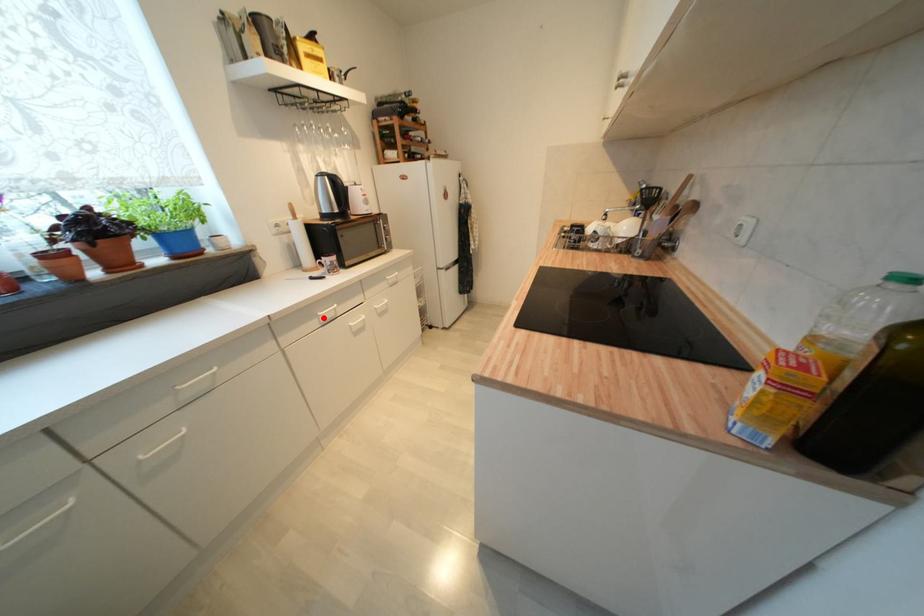
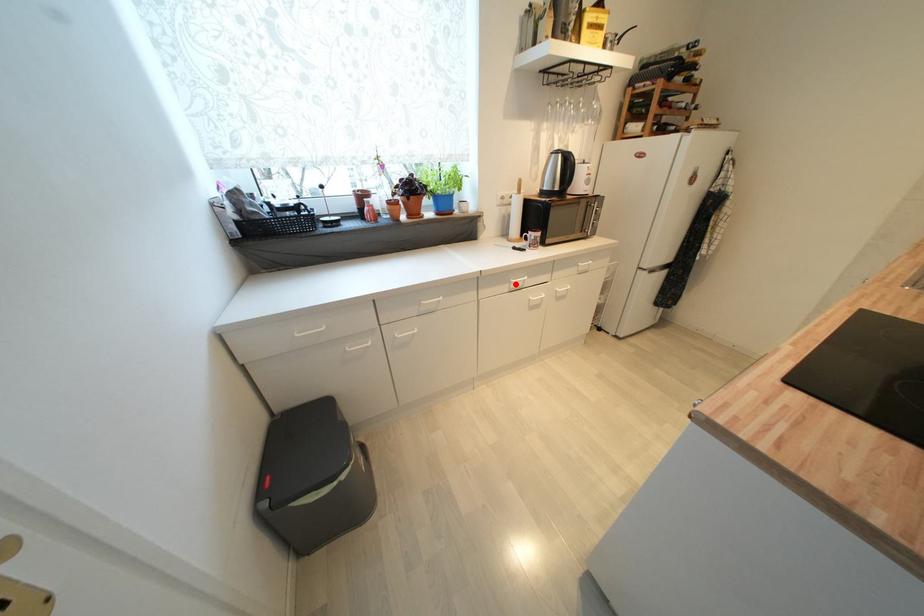
I am providing you with two images of the same scene from different viewpoints. A red point is marked on the first image and another point is marked on the second image. Do the highlighted points in image1 and image2 indicate the same real-world spot?

Yes